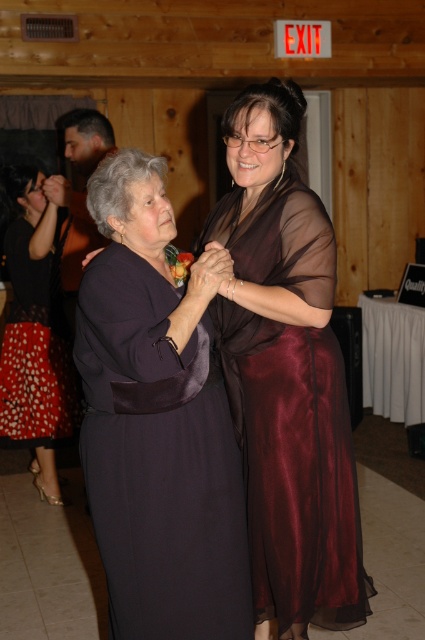
Question: Where is dark satin dress at center located in relation to red dotted fabric dress at lower left in the image?

Choices:
 (A) below
 (B) above

Answer: (A)

Question: Which point is closer to the camera?

Choices:
 (A) dark satin dress at center
 (B) red dotted fabric dress at lower left
 (C) burgundy satin dress at center

Answer: (A)

Question: Which object is the closest to the burgundy satin dress at center?

Choices:
 (A) red dotted fabric dress at lower left
 (B) dark satin dress at center

Answer: (B)

Question: Does burgundy satin dress at center lie behind red dotted fabric dress at lower left?

Choices:
 (A) yes
 (B) no

Answer: (B)

Question: Is burgundy satin dress at center closer to camera compared to red dotted fabric dress at lower left?

Choices:
 (A) yes
 (B) no

Answer: (A)

Question: Among these points, which one is nearest to the camera?

Choices:
 (A) (39, 403)
 (B) (170, 381)

Answer: (B)